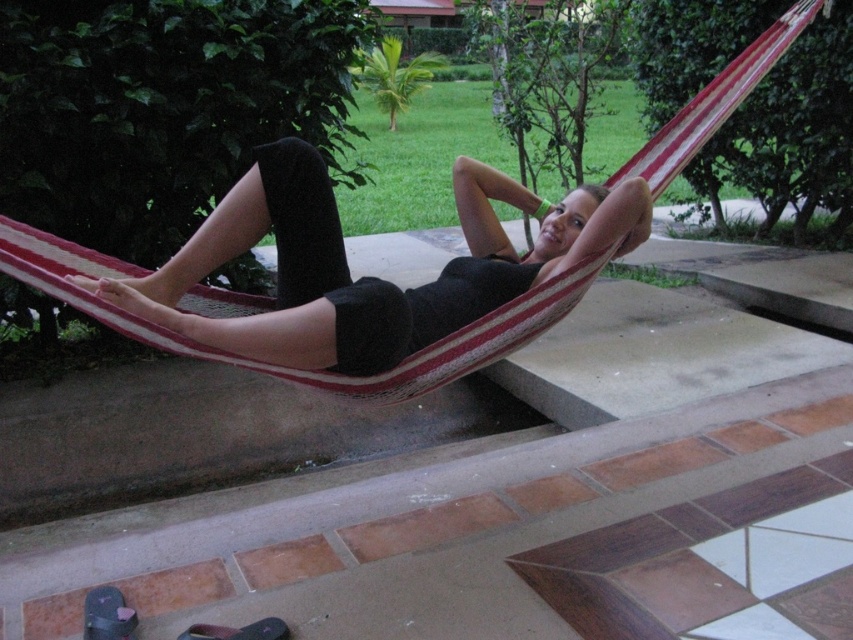
Question: Is matte black shorts at center closer to camera compared to black leather sandal at lower left?

Choices:
 (A) no
 (B) yes

Answer: (A)

Question: Does dark gray fabric sandal at lower left come behind black leather sandal at lower left?

Choices:
 (A) yes
 (B) no

Answer: (A)

Question: Which point appears farthest from the camera in this image?

Choices:
 (A) (149, 330)
 (B) (228, 632)
 (C) (219, 262)
 (D) (102, 609)

Answer: (C)

Question: Estimate the real-world distances between objects in this image. Which object is closer to the dark gray fabric sandal at lower left?

Choices:
 (A) black leather sandal at lower left
 (B) matte black shorts at center
 (C) striped fabric hammock at center

Answer: (A)

Question: Is matte black shorts at center positioned before dark gray fabric sandal at lower left?

Choices:
 (A) no
 (B) yes

Answer: (A)

Question: Which point is closer to the camera taking this photo?

Choices:
 (A) (250, 244)
 (B) (189, 637)

Answer: (B)